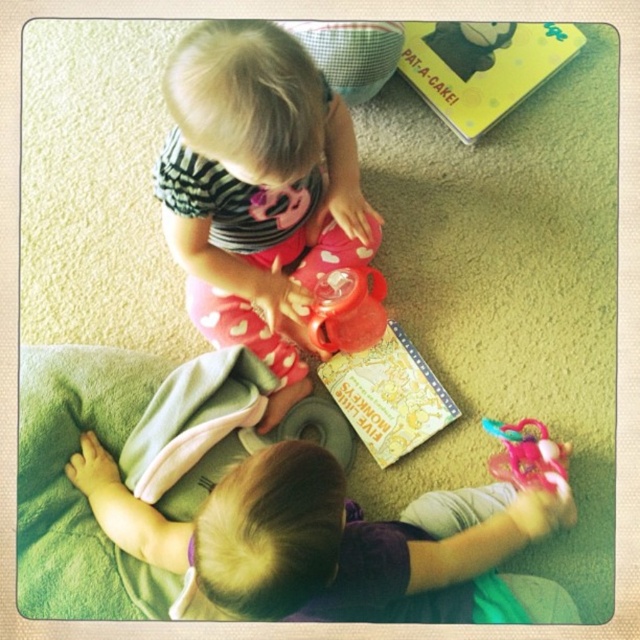
Question: Which object is the farthest from the brown fuzzy blanket at lower center?

Choices:
 (A) pink fabric pants at center
 (B) yellow matte book at upper right

Answer: (B)

Question: Which object appears closest to the camera in this image?

Choices:
 (A) yellow paper book at center
 (B) pink fabric pants at center
 (C) yellow matte book at upper right
 (D) pink plastic toy at lower right

Answer: (B)

Question: Is the position of pink fabric pants at center more distant than that of yellow paper book at center?

Choices:
 (A) no
 (B) yes

Answer: (A)

Question: Among these objects, which one is nearest to the camera?

Choices:
 (A) pink plastic toy at lower right
 (B) yellow matte book at upper right
 (C) yellow paper book at center

Answer: (A)

Question: Considering the relative positions of pink fabric pants at center and yellow paper book at center in the image provided, where is pink fabric pants at center located with respect to yellow paper book at center?

Choices:
 (A) above
 (B) below

Answer: (A)

Question: Is pink fabric pants at center to the left of brown fuzzy blanket at lower center from the viewer's perspective?

Choices:
 (A) yes
 (B) no

Answer: (A)